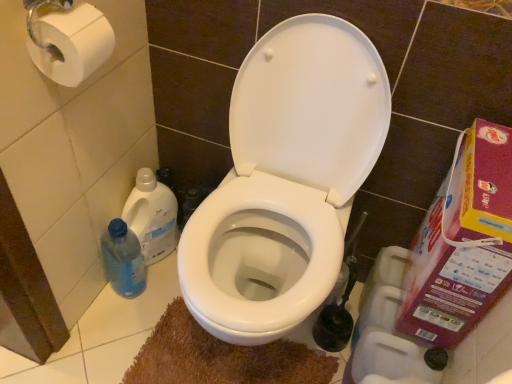
Question: Is plastic cardboard box at right oriented towards translucent plastic bottle at lower left, which is the first cleaning product from top to bottom?

Choices:
 (A) no
 (B) yes

Answer: (B)

Question: From the image's perspective, is plastic cardboard box at right located above translucent plastic bottle at lower left, arranged as the 2th cleaning product when ordered from the bottom?

Choices:
 (A) yes
 (B) no

Answer: (B)

Question: Is plastic cardboard box at right at the left side of translucent plastic bottle at lower left, which is the first cleaning product from top to bottom?

Choices:
 (A) yes
 (B) no

Answer: (B)

Question: Is plastic cardboard box at right shorter than translucent plastic bottle at lower left, which is the first cleaning product from top to bottom?

Choices:
 (A) yes
 (B) no

Answer: (B)

Question: Is plastic cardboard box at right far away from translucent plastic bottle at lower left, arranged as the 2th cleaning product when ordered from the bottom?

Choices:
 (A) no
 (B) yes

Answer: (A)

Question: In terms of height, does translucent plastic bottle at lower left, which is the first cleaning product from top to bottom, look taller or shorter compared to brown plush bath mat at lower center?

Choices:
 (A) short
 (B) tall

Answer: (B)

Question: Is translucent plastic bottle at lower left, which is the first cleaning product from top to bottom, to the left or to the right of brown plush bath mat at lower center in the image?

Choices:
 (A) right
 (B) left

Answer: (B)

Question: In terms of size, does translucent plastic bottle at lower left, arranged as the 2th cleaning product when ordered from the bottom, appear bigger or smaller than brown plush bath mat at lower center?

Choices:
 (A) big
 (B) small

Answer: (A)

Question: Does point (156, 190) appear closer or farther from the camera than point (292, 360)?

Choices:
 (A) closer
 (B) farther

Answer: (B)

Question: In the image, is white matte toilet paper at lower right, the 2th toilet paper viewed from the top, positioned in front of or behind translucent plastic bottle at lower left, arranged as the 2th cleaning product when ordered from the bottom?

Choices:
 (A) front
 (B) behind

Answer: (A)

Question: From the image's perspective, relative to translucent plastic bottle at lower left, arranged as the 2th cleaning product when ordered from the bottom, is white matte toilet paper at lower right, the 2th toilet paper viewed from the front, above or below?

Choices:
 (A) below
 (B) above

Answer: (A)

Question: From their relative heights in the image, would you say white matte toilet paper at lower right, the 2th toilet paper viewed from the top, is taller or shorter than translucent plastic bottle at lower left, which is the first cleaning product from top to bottom?

Choices:
 (A) short
 (B) tall

Answer: (A)

Question: Is point (372, 332) positioned closer to the camera than point (139, 175)?

Choices:
 (A) closer
 (B) farther

Answer: (A)

Question: From the image's perspective, is plastic cardboard box at right above or below white glossy toilet at center?

Choices:
 (A) below
 (B) above

Answer: (A)

Question: Does point (492, 160) appear closer or farther from the camera than point (305, 301)?

Choices:
 (A) closer
 (B) farther

Answer: (A)